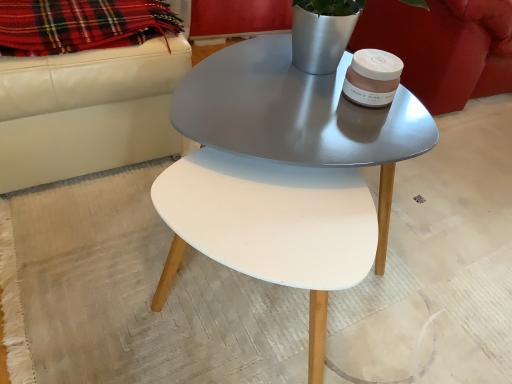
Question: Is metallic gray coffee table at center inside or outside of velvet red armchair at upper right?

Choices:
 (A) inside
 (B) outside

Answer: (B)

Question: Is metallic gray coffee table at center taller or shorter than velvet red armchair at upper right?

Choices:
 (A) tall
 (B) short

Answer: (B)

Question: Estimate the real-world distances between objects in this image. Which object is closer to the velvet red armchair at upper right?

Choices:
 (A) metallic gray coffee table at center
 (B) plaid wool blanket at upper left

Answer: (A)

Question: Which of these objects is positioned farthest from the velvet red armchair at upper right?

Choices:
 (A) plaid wool blanket at upper left
 (B) metallic gray coffee table at center

Answer: (A)